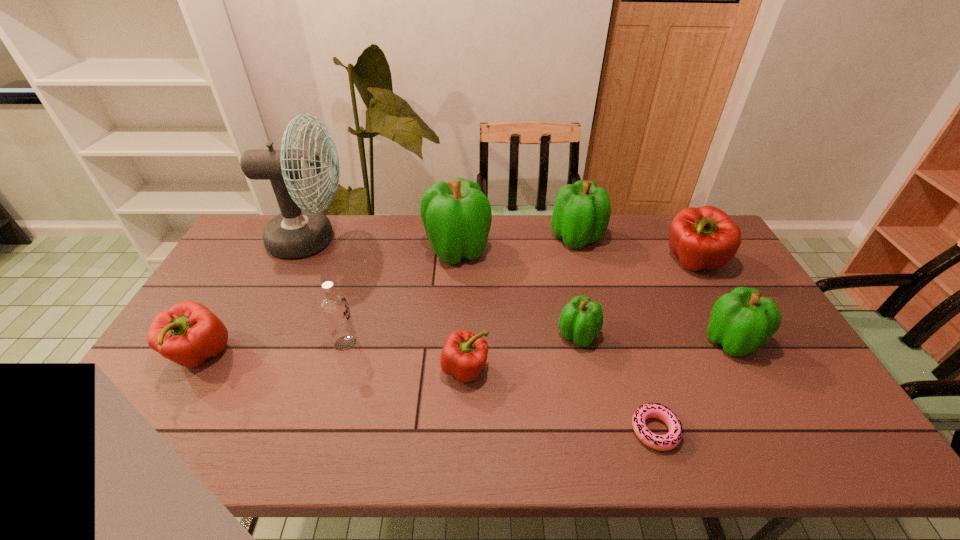
The height and width of the screenshot is (540, 960). In order to click on the smallest green bell pepper in this screenshot , I will do tap(581, 320).

This screenshot has height=540, width=960. Identify the location of the second pink bell pepper from left to right. (464, 354).

Image resolution: width=960 pixels, height=540 pixels. What are the coordinates of `the shortest object` in the screenshot? It's located at (669, 441).

The image size is (960, 540). Find the location of `pink doughnut`. pink doughnut is located at coordinates (669, 441).

At what (x,y) coordinates should I click in order to perform the action: click on free space located in front of the tallest object where the airflow is directed. Please return your answer as a coordinate pair (x, y). This screenshot has width=960, height=540. Looking at the image, I should click on (436, 240).

This screenshot has width=960, height=540. Find the location of `vacant space located on the front of the biggest green bell pepper`. vacant space located on the front of the biggest green bell pepper is located at coordinates (454, 311).

Identify the location of free space located on the left of the third smallest green bell pepper. This screenshot has width=960, height=540. (489, 238).

You are a GUI agent. You are given a task and a screenshot of the screen. Output one action in this format:
    pyautogui.click(x=<x>, y=<y>)
    Task: Click on the vacant space located 0.250m on the front label of the vodka
    
    Given the screenshot: What is the action you would take?
    pyautogui.click(x=447, y=344)

The height and width of the screenshot is (540, 960). I want to click on vacant region located 0.220m on the front of the farthest pink bell pepper, so click(732, 335).

The image size is (960, 540). In order to click on free region located 0.170m on the left of the rightmost green bell pepper in this screenshot , I will do `click(642, 341)`.